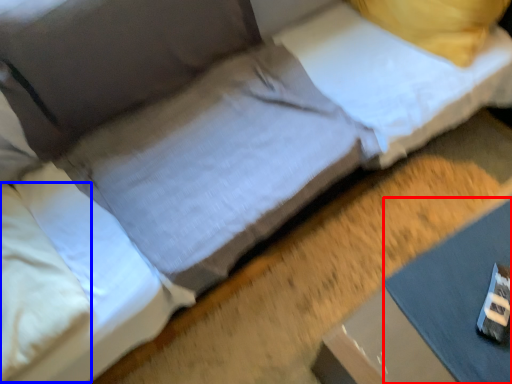
Question: Which of the following is the closest to the observer, sheet (highlighted by a red box) or pillow (highlighted by a blue box)?

Choices:
 (A) sheet
 (B) pillow

Answer: (B)